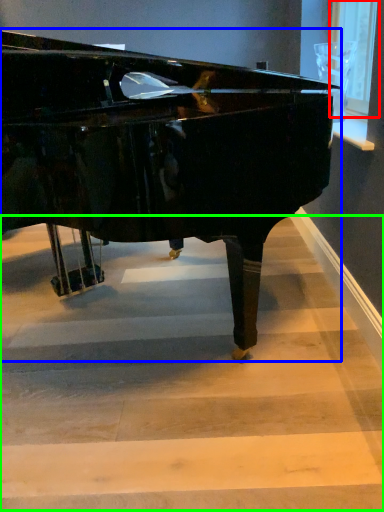
Question: Based on their relative distances, which object is farther from window screen (highlighted by a red box)? Choose from piano (highlighted by a blue box) and stairwell (highlighted by a green box).

Choices:
 (A) piano
 (B) stairwell

Answer: (B)